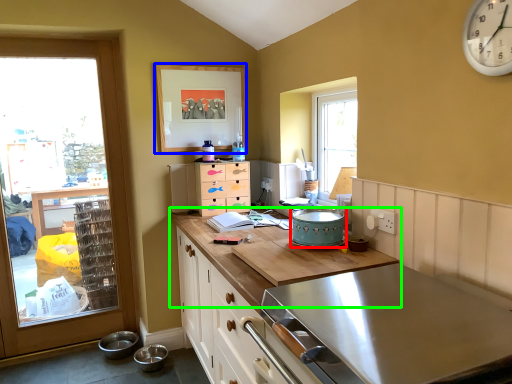
Question: Estimate the real-world distances between objects in this image. Which object is closer to appliance (highlighted by a red box), picture frame (highlighted by a blue box) or countertop (highlighted by a green box)?

Choices:
 (A) picture frame
 (B) countertop

Answer: (B)